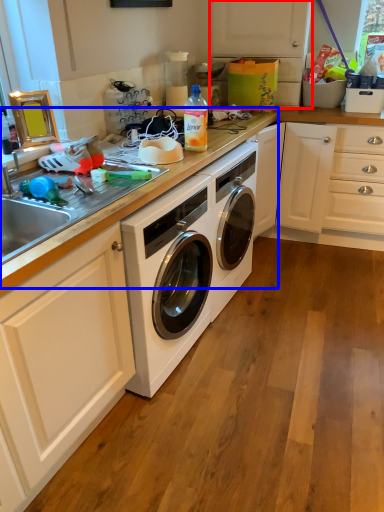
Question: Which object is closer to the camera taking this photo, cabinetry (highlighted by a red box) or counter top (highlighted by a blue box)?

Choices:
 (A) cabinetry
 (B) counter top

Answer: (B)